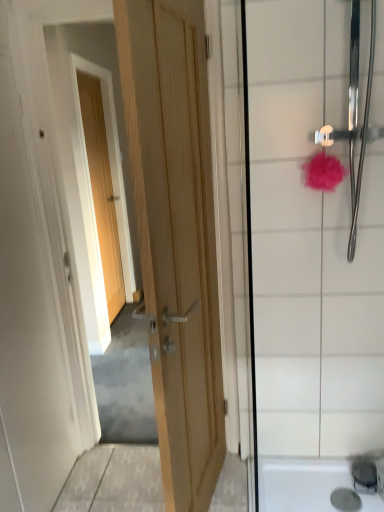
Image resolution: width=384 pixels, height=512 pixels. Find the location of `free space to the left of white glossy shower door at right`. free space to the left of white glossy shower door at right is located at coordinates (260, 476).